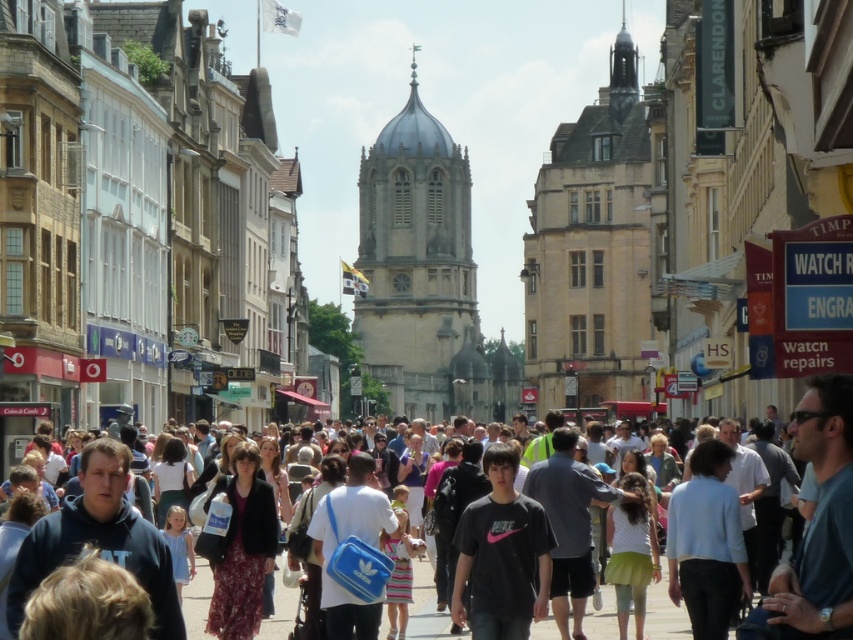
Does stone tower at center appear under dark gray clothing at center?

Actually, stone tower at center is above dark gray clothing at center.

Which of these two, stone tower at center or dark gray clothing at center, stands taller?

With more height is stone tower at center.

Locate an element on the screen. stone tower at center is located at coordinates (421, 273).